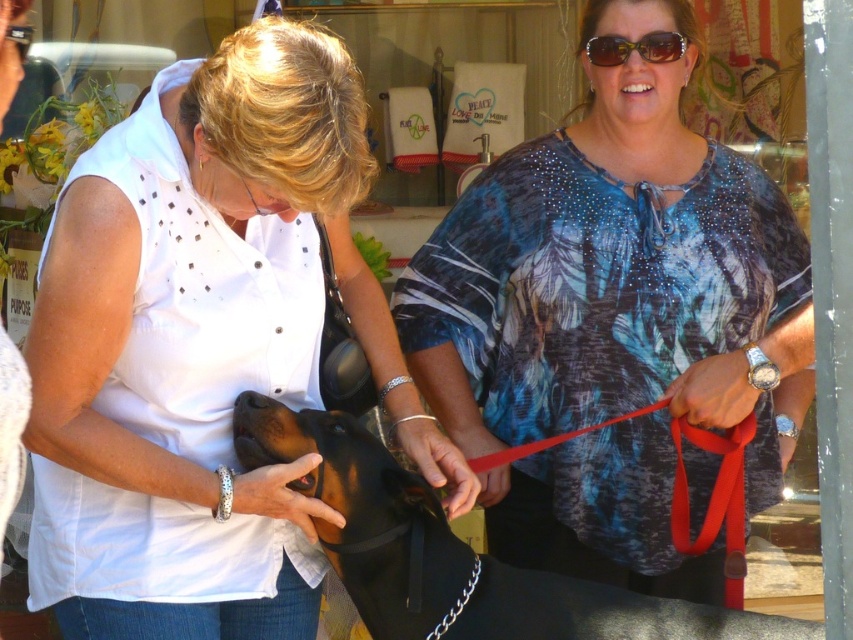
Question: Which object is positioned farthest from the blue tie-dye blouse at center?

Choices:
 (A) sunglasses at upper center
 (B) white dotted shirt at center
 (C) black leather dog at center
 (D) red fabric leash at center right

Answer: (B)

Question: Is white dotted shirt at center positioned before red fabric leash at center right?

Choices:
 (A) yes
 (B) no

Answer: (A)

Question: Which object is the closest to the black leather dog at center?

Choices:
 (A) blue tie-dye blouse at center
 (B) white dotted shirt at center
 (C) sunglasses at upper center
 (D) red fabric leash at center right

Answer: (B)

Question: Does blue tie-dye blouse at center have a smaller size compared to sunglasses at upper center?

Choices:
 (A) yes
 (B) no

Answer: (B)

Question: Which of the following is the closest to the observer?

Choices:
 (A) black leather dog at center
 (B) blue tie-dye blouse at center
 (C) white dotted shirt at center
 (D) sunglasses at upper center

Answer: (C)

Question: Does white dotted shirt at center have a greater width compared to blue tie-dye blouse at center?

Choices:
 (A) no
 (B) yes

Answer: (A)